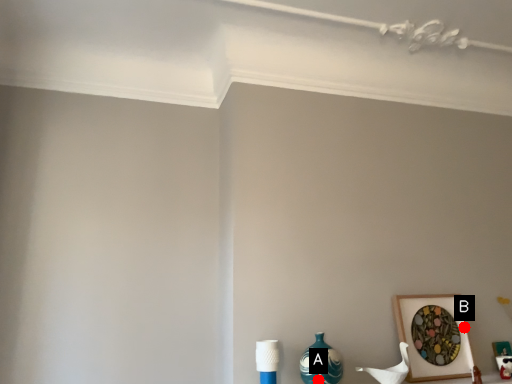
Question: Two points are circled on the image, labeled by A and B beside each circle. Which point appears farthest from the camera in this image?

Choices:
 (A) A is further
 (B) B is further

Answer: (B)